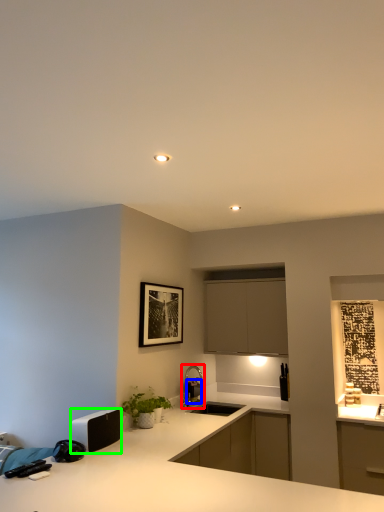
Question: Based on their relative distances, which object is nearer to tap (highlighted by a red box)? Choose from appliance (highlighted by a blue box) and appliance (highlighted by a green box).

Choices:
 (A) appliance
 (B) appliance

Answer: (A)